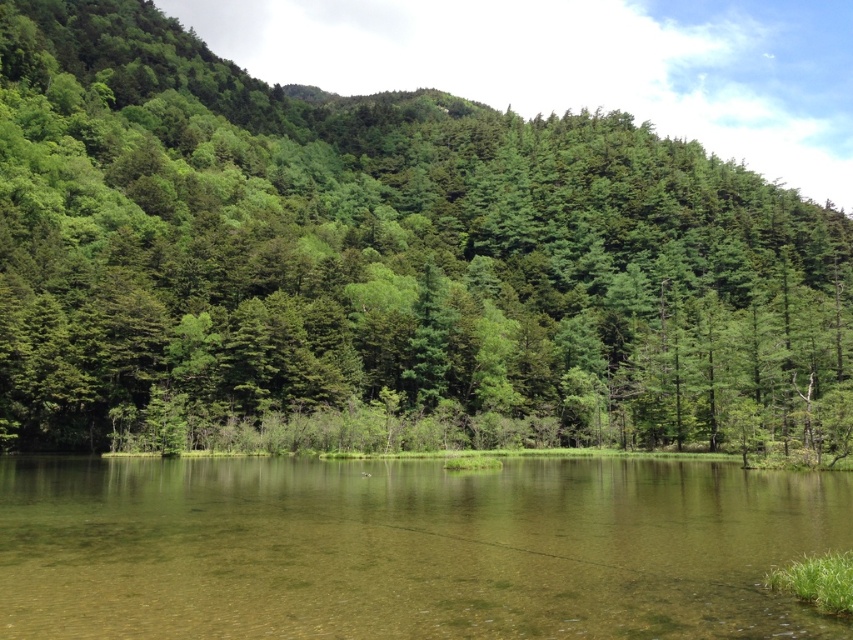
Who is shorter, green matte tree at center or clear water at center?

Standing shorter between the two is clear water at center.

Between point (701, 284) and point (718, 518), which one is positioned behind?

Positioned behind is point (701, 284).

Find the location of a particular element. The image size is (853, 640). green matte tree at center is located at coordinates (383, 259).